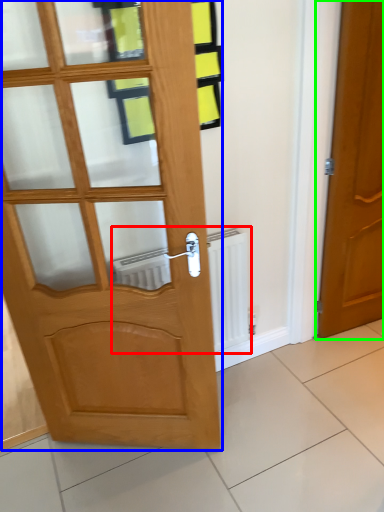
Question: Based on their relative distances, which object is farther from radiator (highlighted by a red box)? Choose from door (highlighted by a blue box) and door (highlighted by a green box).

Choices:
 (A) door
 (B) door

Answer: (B)